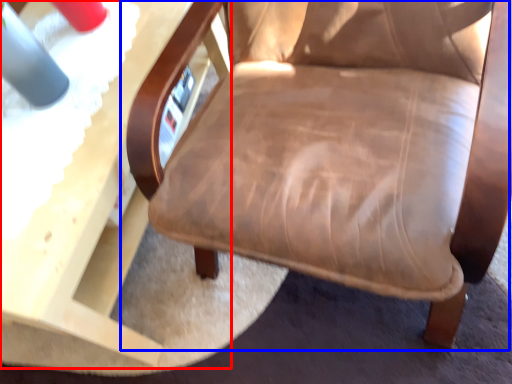
Question: Among these objects, which one is farthest to the camera, table (highlighted by a red box) or chair (highlighted by a blue box)?

Choices:
 (A) table
 (B) chair

Answer: (A)